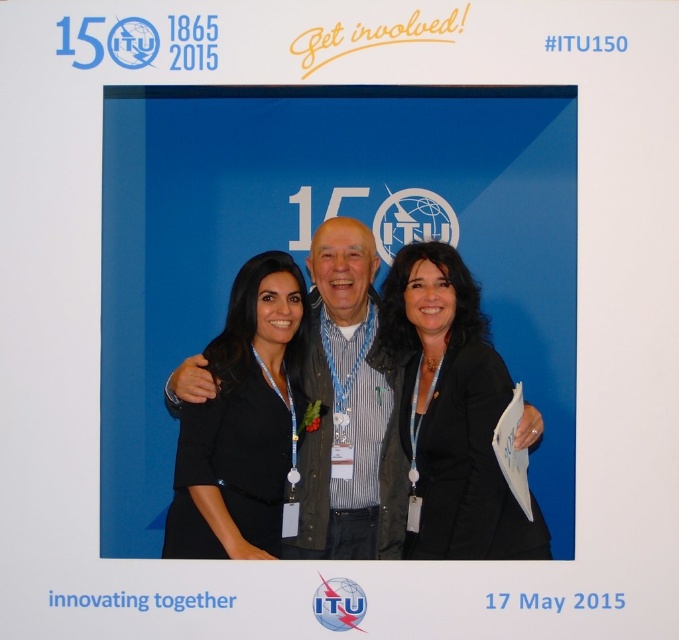
Question: Which object is closer to the camera taking this photo?

Choices:
 (A) black fabric jacket at center
 (B) black matte blazer at center
 (C) black striped shirt at center

Answer: (C)

Question: Which point is closer to the camera?

Choices:
 (A) (430, 442)
 (B) (477, 336)
 (C) (191, 532)

Answer: (C)

Question: Can you confirm if black striped shirt at center is thinner than black matte blazer at center?

Choices:
 (A) yes
 (B) no

Answer: (B)

Question: Observing the image, what is the correct spatial positioning of black striped shirt at center in reference to black matte blazer at center?

Choices:
 (A) right
 (B) left

Answer: (B)

Question: Can you confirm if black striped shirt at center is positioned above black fabric jacket at center?

Choices:
 (A) yes
 (B) no

Answer: (A)

Question: Which object appears farthest from the camera in this image?

Choices:
 (A) black striped shirt at center
 (B) black matte blazer at center

Answer: (B)